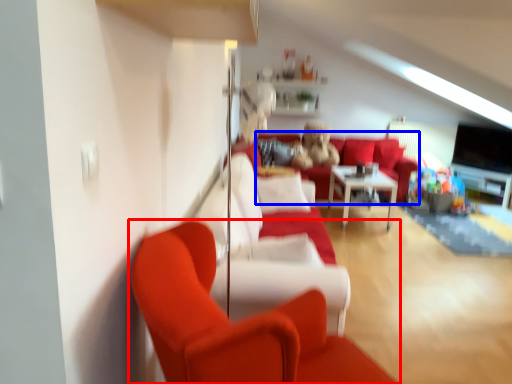
Question: Which point is closer to the camera, studio couch (highlighted by a red box) or couch (highlighted by a blue box)?

Choices:
 (A) studio couch
 (B) couch

Answer: (A)